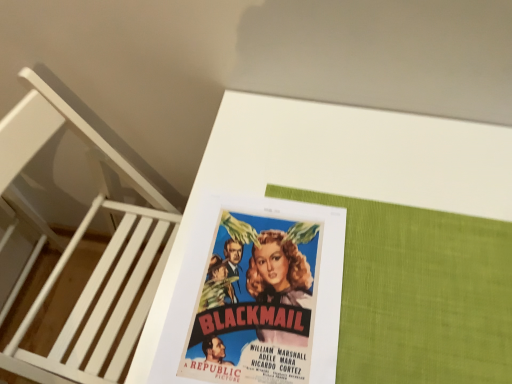
Locate an element on the screen. The image size is (512, 384). white wood bunk bed at upper left is located at coordinates (83, 235).

What do you see at coordinates (83, 235) in the screenshot? I see `white wood bunk bed at upper left` at bounding box center [83, 235].

At what (x,y) coordinates should I click in order to perform the action: click on white wood bunk bed at upper left. Please return your answer as a coordinate pair (x, y). The height and width of the screenshot is (384, 512). Looking at the image, I should click on (83, 235).